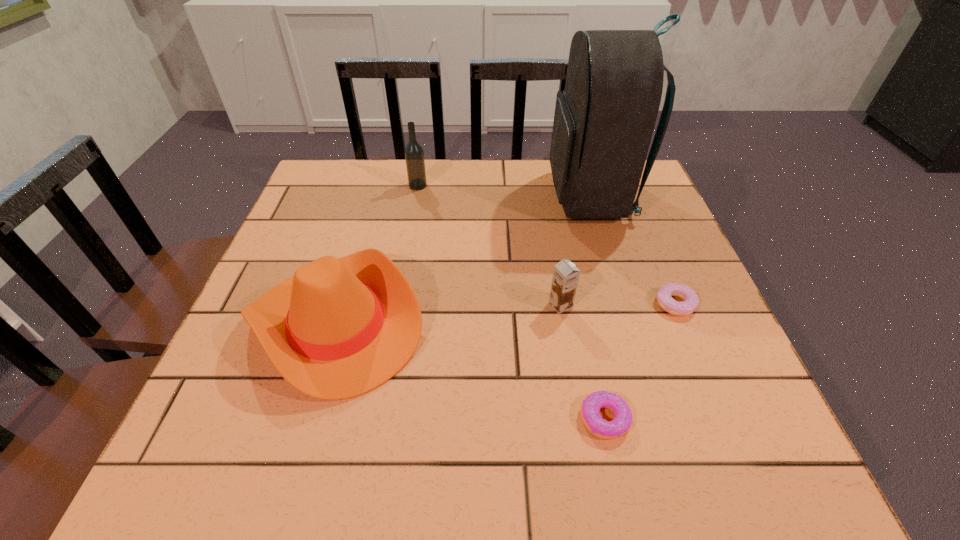
I want to click on object that is at the far right corner, so click(604, 119).

The height and width of the screenshot is (540, 960). In the image, there is a desktop. Find the location of `blank space at the far edge`. blank space at the far edge is located at coordinates (382, 205).

You are a GUI agent. You are given a task and a screenshot of the screen. Output one action in this format:
    pyautogui.click(x=<x>, y=<y>)
    Task: Click on the vacant region at the near edge of the desktop
    The image size is (960, 540).
    Given the screenshot: What is the action you would take?
    click(x=440, y=427)

Locate an element on the screen. vacant space at the left edge is located at coordinates pyautogui.click(x=281, y=400).

In the image, there is a desktop. Identify the location of free space at the right edge. The height and width of the screenshot is (540, 960). (755, 396).

I want to click on free space at the far left corner of the desktop, so click(x=351, y=162).

Where is `vacant space at the near left corner of the desktop`? The image size is (960, 540). vacant space at the near left corner of the desktop is located at coordinates (234, 458).

The width and height of the screenshot is (960, 540). I want to click on vacant space at the near right corner of the desktop, so click(x=708, y=440).

In order to click on vacant region between the right doughnut and the left doughnut in this screenshot , I will do `click(640, 361)`.

I want to click on unoccupied area between the left doughnut and the cowboy hat, so click(x=470, y=371).